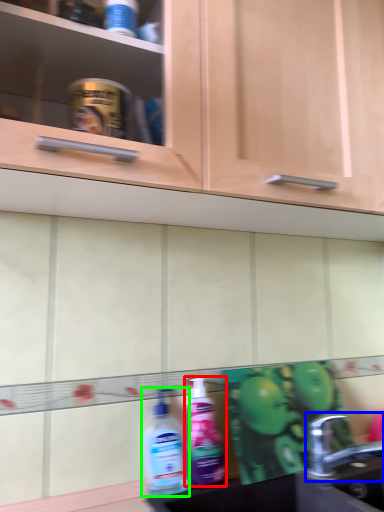
Question: Which is farther away from cleaning product (highlighted by a red box)? tap (highlighted by a blue box) or cleaning product (highlighted by a green box)?

Choices:
 (A) tap
 (B) cleaning product

Answer: (A)